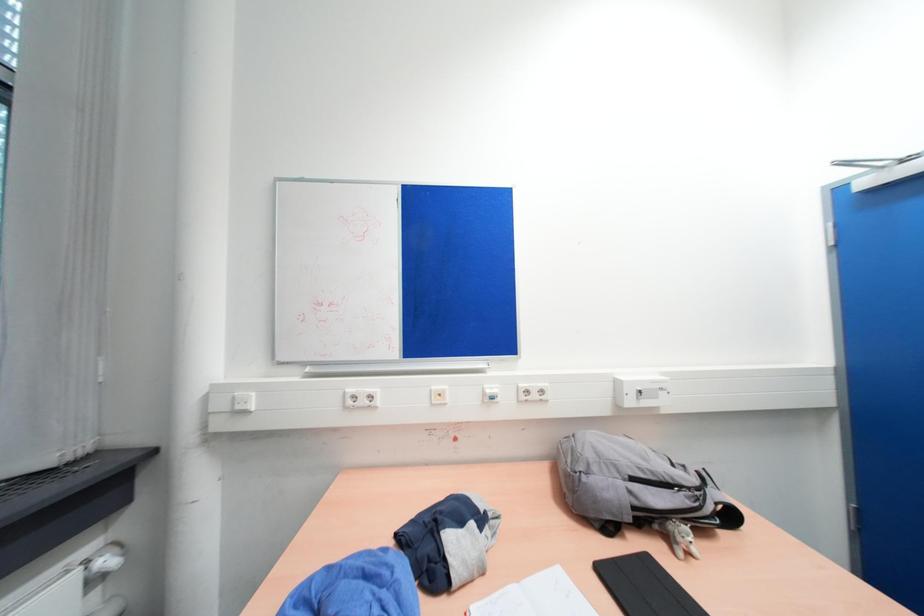
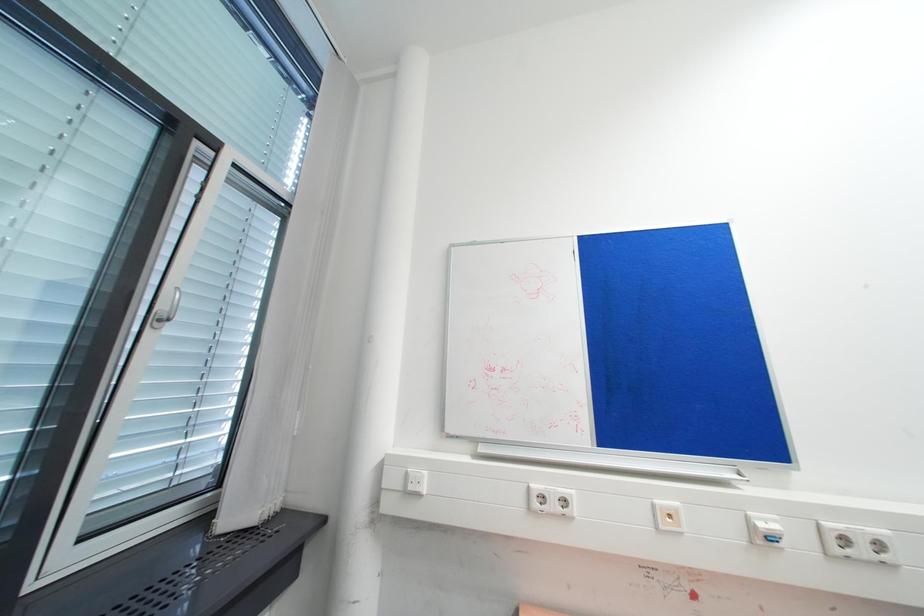
Question: Which direction would the cameraman need to move to produce the second image? Reply with the corresponding letter.

Choices:
 (A) Left
 (B) Right
 (C) Forward
 (D) Backward

Answer: (A)